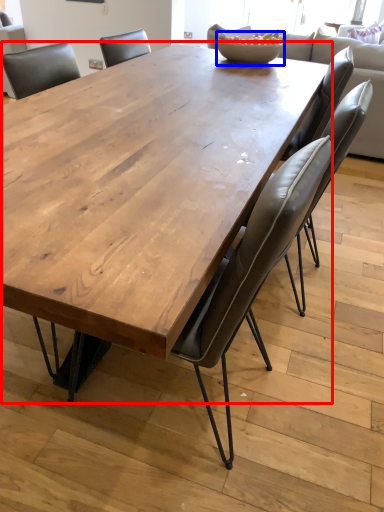
Question: Which object is further to the camera taking this photo, coffee table (highlighted by a red box) or bowl (highlighted by a blue box)?

Choices:
 (A) coffee table
 (B) bowl

Answer: (B)